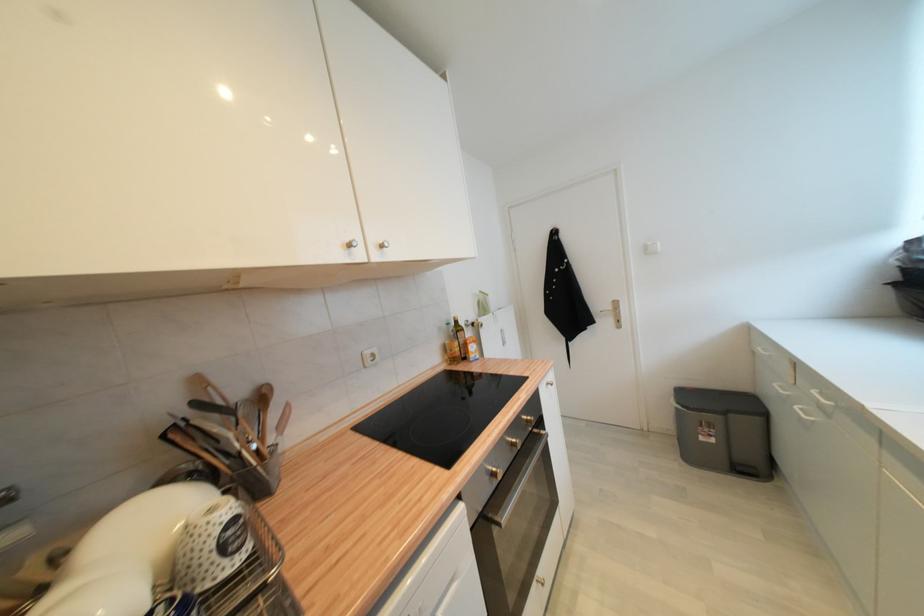
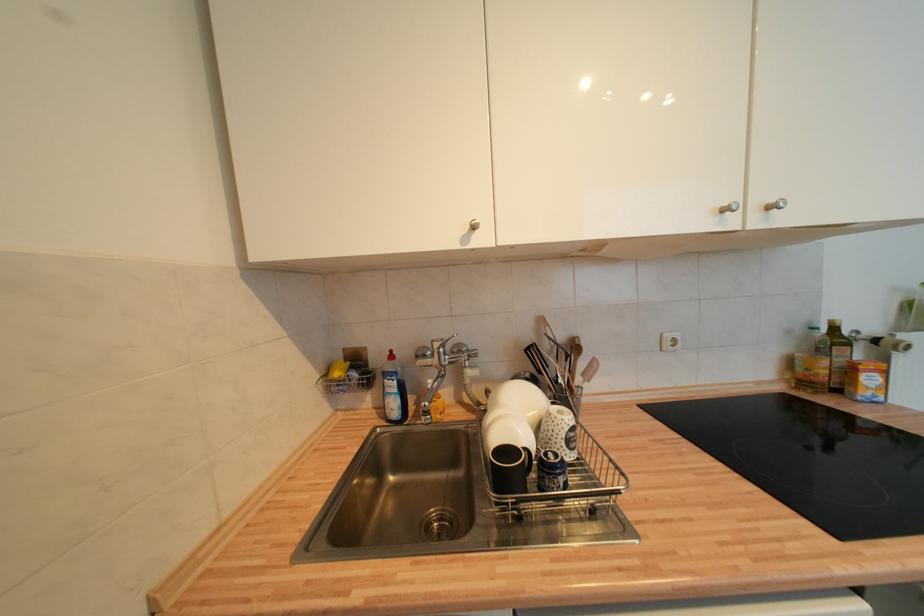
In the second image, find the point that corresponds to point 283,430 in the first image.

(588, 377)